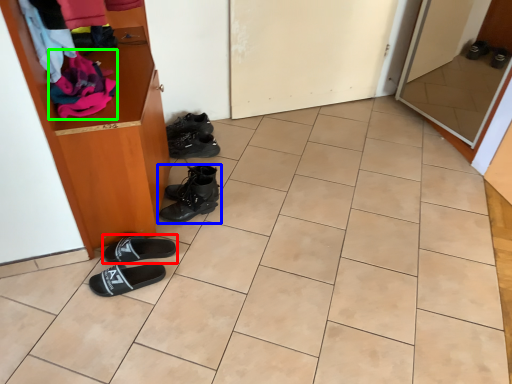
Question: Based on their relative distances, which object is farther from footwear (highlighted by a red box)? Choose from footwear (highlighted by a blue box) and clothing (highlighted by a green box).

Choices:
 (A) footwear
 (B) clothing

Answer: (B)